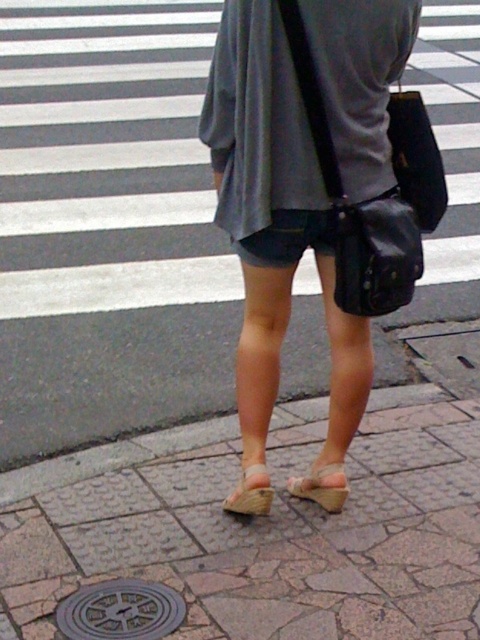
Does brown stone pavement at lower center have a larger size compared to metallic gray manhole cover at lower center?

Indeed, brown stone pavement at lower center has a larger size compared to metallic gray manhole cover at lower center.

The width and height of the screenshot is (480, 640). What do you see at coordinates (254, 531) in the screenshot? I see `brown stone pavement at lower center` at bounding box center [254, 531].

Where is `brown stone pavement at lower center`? This screenshot has height=640, width=480. brown stone pavement at lower center is located at coordinates (254, 531).

In order to click on brick pavement at center in this screenshot , I will do `click(108, 227)`.

Looking at this image, who is more distant from viewer, (126, 348) or (99, 609)?

The point (126, 348) is more distant.

This screenshot has width=480, height=640. I want to click on brick pavement at center, so click(108, 227).

From the picture: Does brick pavement at center have a lesser height compared to brown stone pavement at lower center?

Incorrect, brick pavement at center's height does not fall short of brown stone pavement at lower center's.

Can you confirm if brick pavement at center is positioned to the left of brown stone pavement at lower center?

In fact, brick pavement at center is to the right of brown stone pavement at lower center.

The height and width of the screenshot is (640, 480). In order to click on brick pavement at center in this screenshot , I will do `click(108, 227)`.